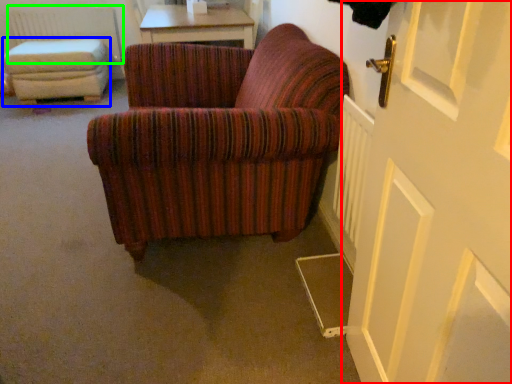
Question: Estimate the real-world distances between objects in this image. Which object is farther from door (highlighted by a red box), stool (highlighted by a blue box) or radiator (highlighted by a green box)?

Choices:
 (A) stool
 (B) radiator

Answer: (B)